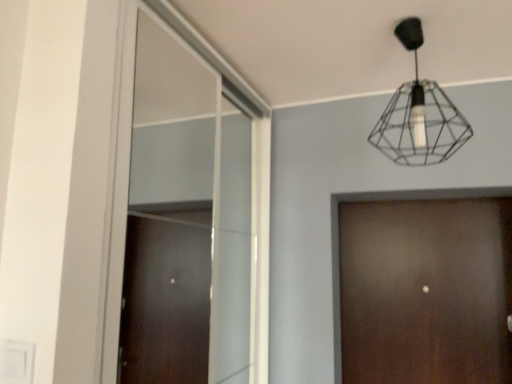
Question: Is clear glass window at center outside of brown wood door at center?

Choices:
 (A) no
 (B) yes

Answer: (B)

Question: From the image's perspective, is clear glass window at center on brown wood door at center?

Choices:
 (A) yes
 (B) no

Answer: (A)

Question: Considering the relative positions of clear glass window at center and brown wood door at center in the image provided, is clear glass window at center to the left of brown wood door at center from the viewer's perspective?

Choices:
 (A) no
 (B) yes

Answer: (B)

Question: Does clear glass window at center have a smaller size compared to brown wood door at center?

Choices:
 (A) yes
 (B) no

Answer: (B)

Question: Is clear glass window at center thinner than brown wood door at center?

Choices:
 (A) no
 (B) yes

Answer: (B)

Question: From a real-world perspective, is clear glass window at center on top of brown wood door at center?

Choices:
 (A) yes
 (B) no

Answer: (A)

Question: Considering the relative sizes of brown wood door at center and clear glass window at center in the image provided, is brown wood door at center shorter than clear glass window at center?

Choices:
 (A) no
 (B) yes

Answer: (B)

Question: Considering the relative sizes of brown wood door at center and clear glass window at center in the image provided, is brown wood door at center smaller than clear glass window at center?

Choices:
 (A) no
 (B) yes

Answer: (B)

Question: Considering the relative positions of brown wood door at center and clear glass window at center in the image provided, is brown wood door at center to the left of clear glass window at center from the viewer's perspective?

Choices:
 (A) no
 (B) yes

Answer: (A)

Question: From the image's perspective, does brown wood door at center appear higher than clear glass window at center?

Choices:
 (A) no
 (B) yes

Answer: (A)

Question: From a real-world perspective, is brown wood door at center beneath clear glass window at center?

Choices:
 (A) no
 (B) yes

Answer: (B)

Question: Are brown wood door at center and clear glass window at center making contact?

Choices:
 (A) yes
 (B) no

Answer: (B)

Question: From the image's perspective, is clear glass window at center above wireframe black lamp at upper center?

Choices:
 (A) no
 (B) yes

Answer: (A)